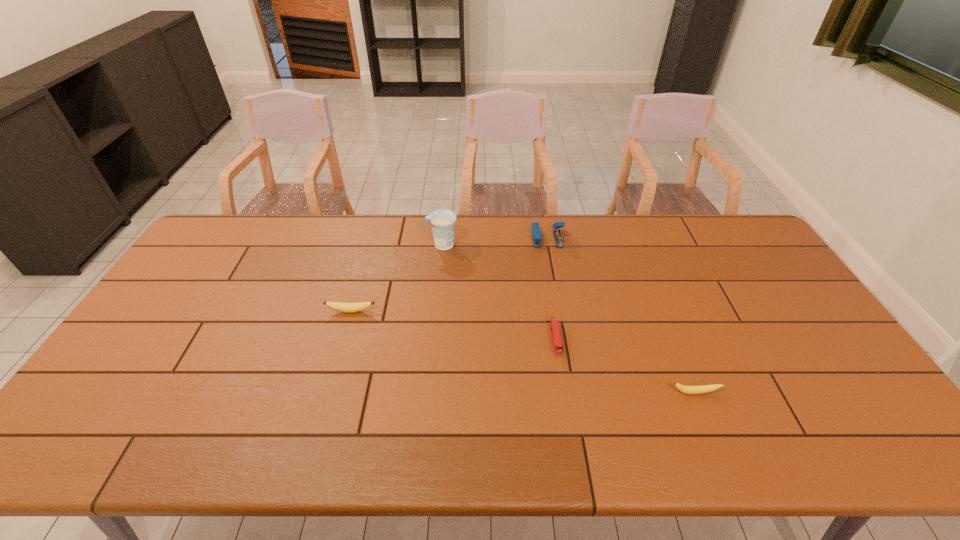
Where is `yogurt`? The width and height of the screenshot is (960, 540). yogurt is located at coordinates pyautogui.click(x=442, y=221).

This screenshot has width=960, height=540. Find the location of `the second object from left to right`. the second object from left to right is located at coordinates (442, 221).

Find the location of `the taller stapler`. the taller stapler is located at coordinates (536, 233).

The image size is (960, 540). Find the location of `the fourth shortest object`. the fourth shortest object is located at coordinates tap(536, 233).

Where is `the nearer stapler`? the nearer stapler is located at coordinates (x=554, y=324).

Identify the location of the fourth farthest object. (554, 324).

The width and height of the screenshot is (960, 540). Identify the location of the farther banana. tap(339, 306).

Where is `the left banana`? This screenshot has height=540, width=960. the left banana is located at coordinates (339, 306).

The image size is (960, 540). I want to click on the rightmost object, so click(685, 389).

Where is `the nearest object`? This screenshot has width=960, height=540. the nearest object is located at coordinates (685, 389).